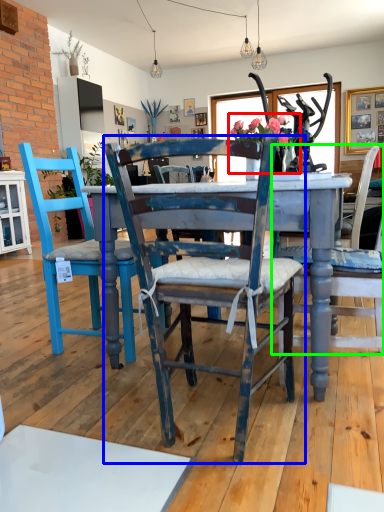
Question: Estimate the real-world distances between objects in this image. Which object is farther from floral arrangement (highlighted by a red box), chair (highlighted by a blue box) or chair (highlighted by a green box)?

Choices:
 (A) chair
 (B) chair

Answer: (A)